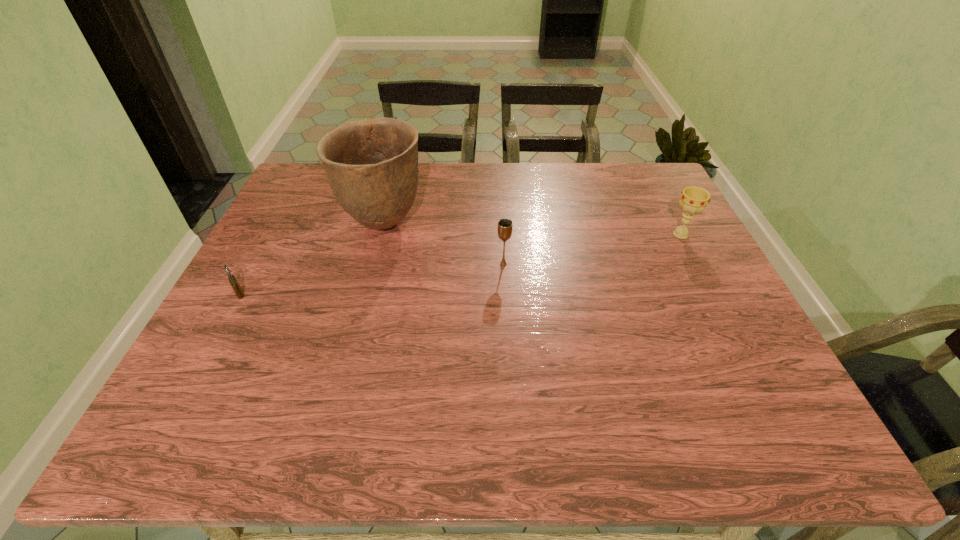
At what (x,y) coordinates should I click in order to perform the action: click on vacant space that is in between the tallest object and the third object from left to right. Please return your answer as a coordinate pair (x, y). The height and width of the screenshot is (540, 960). Looking at the image, I should click on (444, 244).

Identify the location of empty space that is in between the third object from right to left and the shortest object. (311, 259).

Locate an element on the screen. The height and width of the screenshot is (540, 960). free space that is in between the third object from right to left and the nearer chalice is located at coordinates (444, 244).

In order to click on vacant space that's between the nearest object and the tallest object in this screenshot , I will do `click(311, 259)`.

Locate an element on the screen. This screenshot has width=960, height=540. free area in between the second object from right to left and the shortest object is located at coordinates (372, 279).

The width and height of the screenshot is (960, 540). What are the coordinates of `free space between the right chalice and the tallest object` in the screenshot? It's located at (532, 230).

You are a GUI agent. You are given a task and a screenshot of the screen. Output one action in this format:
    pyautogui.click(x=<x>, y=<y>)
    Task: Click on the unoccupied position between the third object from right to left and the nearest object
    The image size is (960, 540).
    Given the screenshot: What is the action you would take?
    pyautogui.click(x=311, y=259)

This screenshot has height=540, width=960. In order to click on vacant area between the right chalice and the leftmost object in this screenshot , I will do `click(460, 264)`.

The image size is (960, 540). I want to click on vacant space that's between the padlock and the second nearest object, so (x=372, y=279).

At what (x,y) coordinates should I click in order to perform the action: click on unoccupied position between the right chalice and the second object from left to right. Please return your answer as a coordinate pair (x, y). The height and width of the screenshot is (540, 960). Looking at the image, I should click on (532, 230).